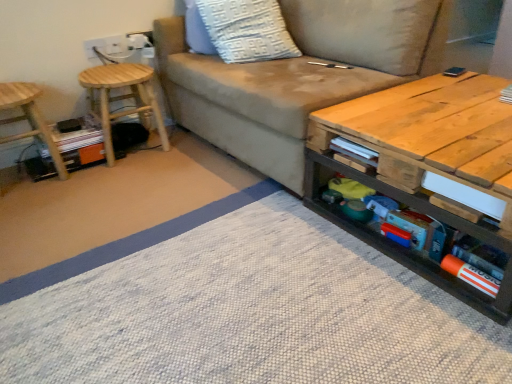
Question: Does natural wood coffee table at center lie in front of orange matte book at lower right, the second book in the left-to-right sequence?

Choices:
 (A) yes
 (B) no

Answer: (A)

Question: From the image's perspective, is natural wood coffee table at center located above orange matte book at lower right, arranged as the first book when viewed from the front?

Choices:
 (A) yes
 (B) no

Answer: (A)

Question: Does natural wood coffee table at center appear on the right side of orange matte book at lower right, arranged as the first book when viewed from the front?

Choices:
 (A) no
 (B) yes

Answer: (B)

Question: Can you confirm if natural wood coffee table at center is bigger than orange matte book at lower right, which appears as the third book when viewed from the back?

Choices:
 (A) no
 (B) yes

Answer: (B)

Question: Does natural wood coffee table at center have a lesser height compared to orange matte book at lower right, the second book in the left-to-right sequence?

Choices:
 (A) yes
 (B) no

Answer: (B)

Question: From their relative heights in the image, would you say white paper book at right, placed as the 1th book when sorted from back to front, is taller or shorter than suede beige couch at center?

Choices:
 (A) short
 (B) tall

Answer: (A)

Question: Is white paper book at right, the 1th book from the top, inside the boundaries of suede beige couch at center, or outside?

Choices:
 (A) inside
 (B) outside

Answer: (B)

Question: Is white paper book at right, the 3th book when ordered from left to right, to the left or to the right of suede beige couch at center in the image?

Choices:
 (A) left
 (B) right

Answer: (B)

Question: Is point (504, 87) closer or farther from the camera than point (346, 82)?

Choices:
 (A) closer
 (B) farther

Answer: (A)

Question: Looking at their shapes, would you say natural wood coffee table at center is wider or thinner than white textured pillow at upper center?

Choices:
 (A) thin
 (B) wide

Answer: (B)

Question: From the image's perspective, is natural wood coffee table at center above or below white textured pillow at upper center?

Choices:
 (A) below
 (B) above

Answer: (A)

Question: Is natural wood coffee table at center in front of or behind white textured pillow at upper center in the image?

Choices:
 (A) front
 (B) behind

Answer: (A)

Question: Is point (355, 114) closer or farther from the camera than point (289, 49)?

Choices:
 (A) farther
 (B) closer

Answer: (B)

Question: From their relative heights in the image, would you say wooden stool at left, positioned as the first stool in left-to-right order, is taller or shorter than white textured pillow at upper center?

Choices:
 (A) short
 (B) tall

Answer: (B)

Question: Is wooden stool at left, placed as the 2th stool when sorted from right to left, to the left or to the right of white textured pillow at upper center in the image?

Choices:
 (A) left
 (B) right

Answer: (A)